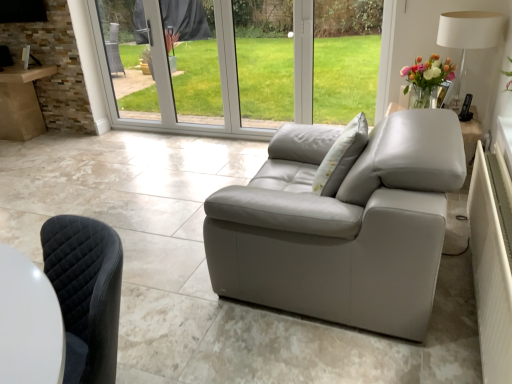
I want to click on light gray fabric pillow at center, so (341, 157).

What do you see at coordinates (341, 157) in the screenshot? I see `light gray fabric pillow at center` at bounding box center [341, 157].

Measure the distance between point (326, 154) and camera.

Point (326, 154) and camera are 6.97 feet apart.

The width and height of the screenshot is (512, 384). What do you see at coordinates (469, 32) in the screenshot? I see `white fabric lampshade at upper right` at bounding box center [469, 32].

The image size is (512, 384). I want to click on white fabric lampshade at upper right, so click(x=469, y=32).

Locate an element on the screen. light gray fabric pillow at center is located at coordinates (341, 157).

Can you confirm if light gray fabric pillow at center is positioned to the left of white fabric lampshade at upper right?

Yes.

Which object is closer to the camera taking this photo, light gray fabric pillow at center or white fabric lampshade at upper right?

light gray fabric pillow at center is more forward.

Does point (314, 178) come farther from viewer compared to point (469, 32)?

That is False.

From the image's perspective, between light gray fabric pillow at center and white fabric lampshade at upper right, which one is located above?

From the image's view, white fabric lampshade at upper right is above.

From a real-world perspective, is light gray fabric pillow at center physically located above or below white fabric lampshade at upper right?

light gray fabric pillow at center is below white fabric lampshade at upper right.

From the picture: Which of these two, light gray fabric pillow at center or white fabric lampshade at upper right, is thinner?

Thinner between the two is light gray fabric pillow at center.

From their relative heights in the image, would you say light gray fabric pillow at center is taller or shorter than white fabric lampshade at upper right?

Considering their sizes, light gray fabric pillow at center has less height than white fabric lampshade at upper right.

Does light gray fabric pillow at center have a smaller size compared to white fabric lampshade at upper right?

Yes, light gray fabric pillow at center is smaller than white fabric lampshade at upper right.

Is light gray fabric pillow at center spatially inside white fabric lampshade at upper right, or outside of it?

light gray fabric pillow at center is not enclosed by white fabric lampshade at upper right.

Is the surface of light gray fabric pillow at center in direct contact with white fabric lampshade at upper right?

No, light gray fabric pillow at center is not making contact with white fabric lampshade at upper right.

Is light gray fabric pillow at center oriented away from white fabric lampshade at upper right?

That's not correct — light gray fabric pillow at center is not looking away from white fabric lampshade at upper right.

What's the angular difference between light gray fabric pillow at center and white fabric lampshade at upper right's facing directions?

There is a 11.4-degree angle between the facing directions of light gray fabric pillow at center and white fabric lampshade at upper right.

The height and width of the screenshot is (384, 512). I want to click on pillow that is below the white fabric lampshade at upper right (from the image's perspective), so click(x=341, y=157).

In the image, is white fabric lampshade at upper right on the left side or the right side of light gray fabric pillow at center?

From the image, it's evident that white fabric lampshade at upper right is to the right of light gray fabric pillow at center.

Considering their positions, is white fabric lampshade at upper right located in front of or behind light gray fabric pillow at center?

white fabric lampshade at upper right is behind light gray fabric pillow at center.

Which is closer to the camera, [448,13] or [329,155]?

Point [448,13].

From the image's perspective, is white fabric lampshade at upper right below light gray fabric pillow at center?

Actually, white fabric lampshade at upper right appears above light gray fabric pillow at center in the image.

From a real-world perspective, is white fabric lampshade at upper right physically located above or below light gray fabric pillow at center?

Clearly, from a real-world perspective, white fabric lampshade at upper right is above light gray fabric pillow at center.

Considering the sizes of objects white fabric lampshade at upper right and light gray fabric pillow at center in the image provided, who is wider, white fabric lampshade at upper right or light gray fabric pillow at center?

white fabric lampshade at upper right is wider.

Is white fabric lampshade at upper right taller than light gray fabric pillow at center?

Yes.

In the scene shown: Between white fabric lampshade at upper right and light gray fabric pillow at center, which one has smaller size?

Smaller between the two is light gray fabric pillow at center.

Can light gray fabric pillow at center be found inside white fabric lampshade at upper right?

No, light gray fabric pillow at center is not inside white fabric lampshade at upper right.

Is there a large distance between white fabric lampshade at upper right and light gray fabric pillow at center?

Yes, white fabric lampshade at upper right and light gray fabric pillow at center are located far from each other.

Is white fabric lampshade at upper right oriented towards light gray fabric pillow at center?

No, white fabric lampshade at upper right is not turned towards light gray fabric pillow at center.

How many degrees apart are the facing directions of white fabric lampshade at upper right and light gray fabric pillow at center?

11.4 degrees separate the facing orientations of white fabric lampshade at upper right and light gray fabric pillow at center.

In the scene shown: How distant is white fabric lampshade at upper right from light gray fabric pillow at center?

white fabric lampshade at upper right and light gray fabric pillow at center are 1.05 meters apart from each other.

You are a GUI agent. You are given a task and a screenshot of the screen. Output one action in this format:
    pyautogui.click(x=<x>, y=<y>)
    Task: Click on the lamp behind the light gray fabric pillow at center
    The image size is (512, 384).
    Given the screenshot: What is the action you would take?
    pyautogui.click(x=469, y=32)

Identify the location of lamp that appears above the light gray fabric pillow at center (from a real-world perspective). (469, 32).

In the image, there is a white fabric lampshade at upper right. Identify the location of pillow below it (from the image's perspective). (341, 157).